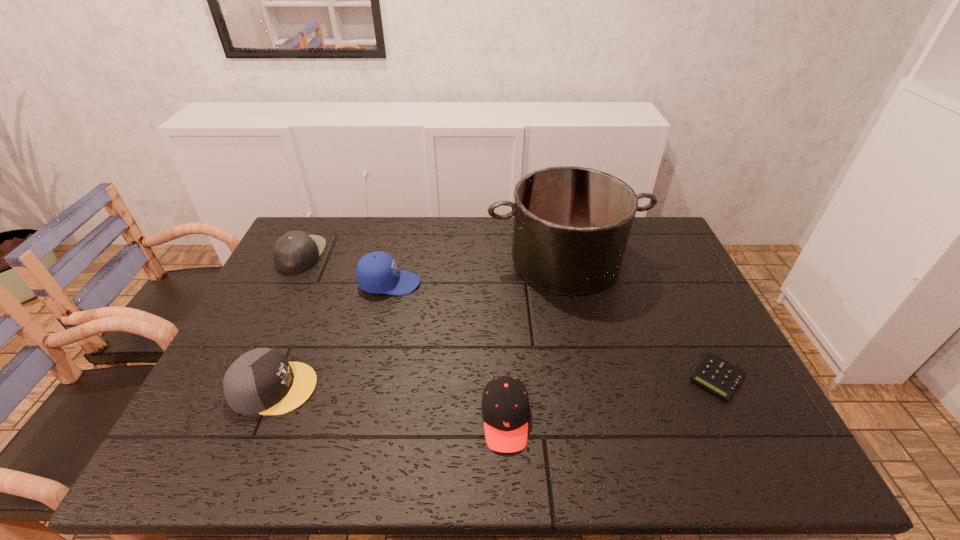
Locate an element on the screen. This screenshot has width=960, height=540. free space that satisfies the following two spatial constraints: 1. on the front-facing side of the calculator; 2. on the right side of the third cap from left to right is located at coordinates (369, 377).